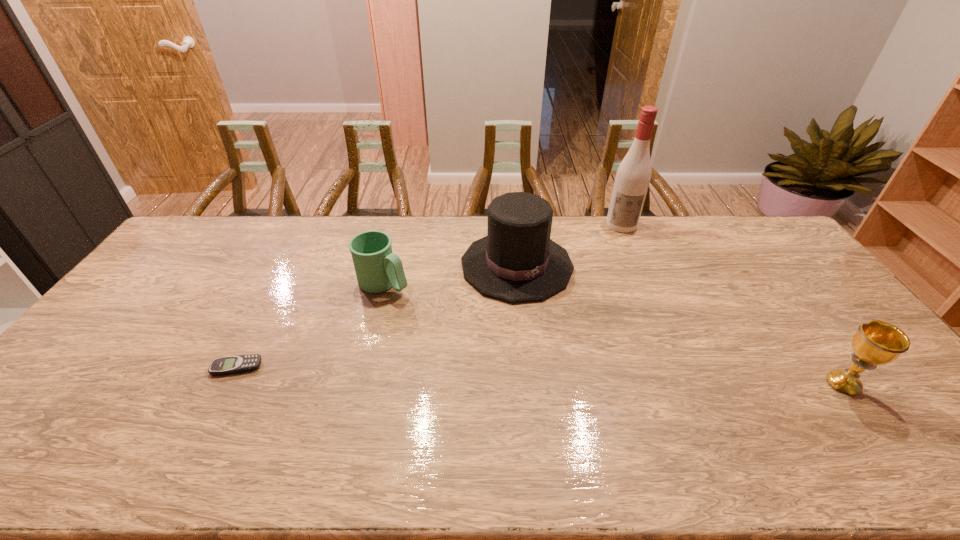
You are a GUI agent. You are given a task and a screenshot of the screen. Output one action in this format:
    pyautogui.click(x=<x>, y=<y>)
    Task: Click on the free space at the far right corner of the desktop
    The width and height of the screenshot is (960, 540).
    Given the screenshot: What is the action you would take?
    pyautogui.click(x=750, y=225)

Where is `vacant space that is in between the shortest object and the mug`? vacant space that is in between the shortest object and the mug is located at coordinates (310, 325).

Where is `empty space that is in between the shortest object and the rightmost object`? The width and height of the screenshot is (960, 540). empty space that is in between the shortest object and the rightmost object is located at coordinates (540, 375).

Identify the location of vacant space that's between the chalice and the mug. The image size is (960, 540). (613, 334).

Identify the location of free point between the second object from right to left and the leftmost object. The height and width of the screenshot is (540, 960). (429, 296).

You are a GUI agent. You are given a task and a screenshot of the screen. Output one action in this format:
    pyautogui.click(x=<x>, y=<y>)
    Task: Click on the vacant area that lies between the chalice and the leftmost object
    This screenshot has height=540, width=960.
    Given the screenshot: What is the action you would take?
    pyautogui.click(x=540, y=375)

The image size is (960, 540). Find the location of `unoccupied area between the fourth shortest object and the fourth tallest object`. unoccupied area between the fourth shortest object and the fourth tallest object is located at coordinates click(450, 274).

At what (x,y) coordinates should I click in order to perform the action: click on free space between the second object from left to right and the leftmost object. Please return your answer as a coordinate pair (x, y). Image resolution: width=960 pixels, height=540 pixels. Looking at the image, I should click on (310, 325).

Identify the location of free space between the fourth shortest object and the beeper. (376, 316).

What are the coordinates of `free space between the dress hat and the fourth tallest object` in the screenshot? It's located at (450, 274).